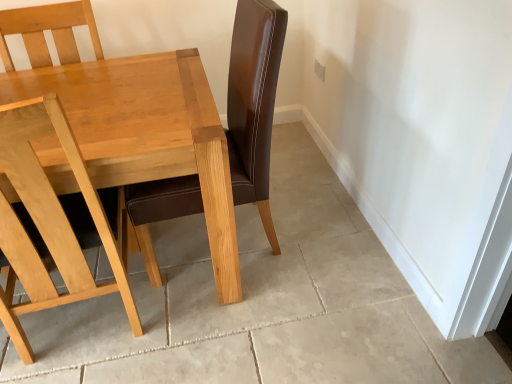
The width and height of the screenshot is (512, 384). Find the location of `spots to the right of light wood chair at left`. spots to the right of light wood chair at left is located at coordinates (214, 331).